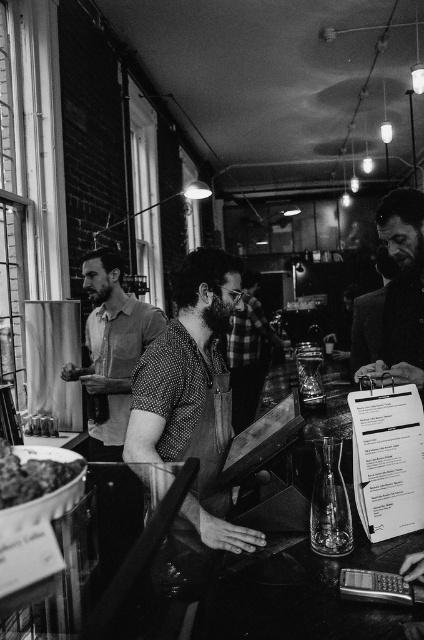
Who is shorter, white paper menu at center or dark textured salad bowl at lower left?

dark textured salad bowl at lower left is shorter.

Is white paper menu at center further to the viewer compared to dark textured salad bowl at lower left?

Yes, it is behind dark textured salad bowl at lower left.

The width and height of the screenshot is (424, 640). In order to click on white paper menu at center in this screenshot , I will do `click(387, 460)`.

This screenshot has height=640, width=424. What do you see at coordinates (181, 356) in the screenshot?
I see `polka dot shirt at center` at bounding box center [181, 356].

Does polka dot shirt at center have a smaller size compared to smooth leather jacket at right?

Correct, polka dot shirt at center occupies less space than smooth leather jacket at right.

Is point (201, 317) less distant than point (395, 243)?

Yes.

At what (x,y) coordinates should I click in order to perform the action: click on polka dot shirt at center. Please return your answer as a coordinate pair (x, y). Looking at the image, I should click on (181, 356).

Based on the photo, does polka dot shirt at center appear on the left side of dark textured salad bowl at lower left?

In fact, polka dot shirt at center is to the right of dark textured salad bowl at lower left.

Who is taller, polka dot shirt at center or dark textured salad bowl at lower left?

Standing taller between the two is polka dot shirt at center.

Is point (144, 413) farther from viewer compared to point (5, 502)?

Yes.

Where is `polka dot shirt at center`? polka dot shirt at center is located at coordinates (181, 356).